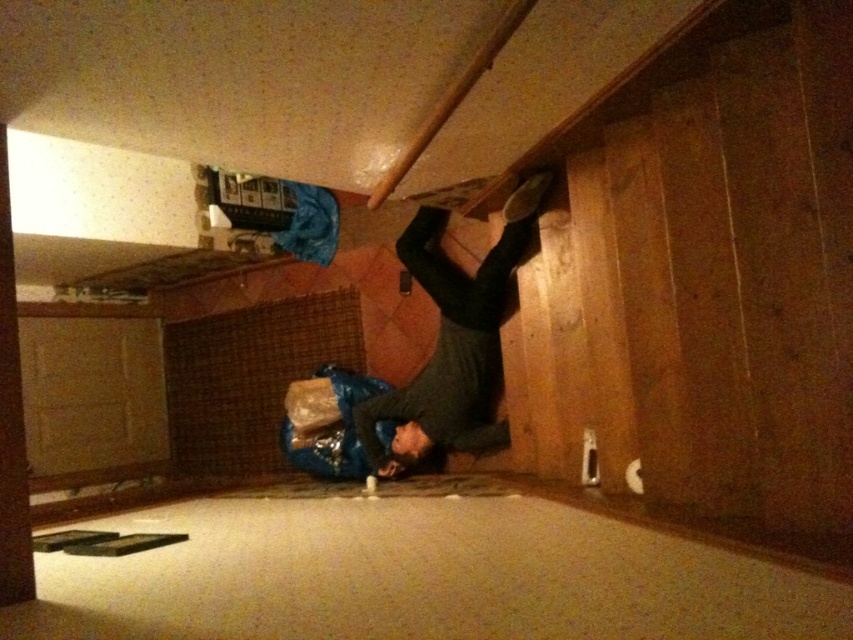
Is carpet at lower center wider than dark gray sweater at center?

Yes.

Is point (631, 636) farther from camera compared to point (440, 252)?

No.

Image resolution: width=853 pixels, height=640 pixels. Identify the location of carpet at lower center. (418, 577).

This screenshot has height=640, width=853. I want to click on carpet at lower center, so click(418, 577).

Consider the image. Who is positioned more to the left, dark gray sweater at center or wooden beam at upper center?

wooden beam at upper center is more to the left.

Is point (515, 240) less distant than point (399, 168)?

That is False.

Where is `dark gray sweater at center`? dark gray sweater at center is located at coordinates (451, 342).

Who is lower down, carpet at lower center or wooden beam at upper center?

carpet at lower center is lower down.

Where is `carpet at lower center`? This screenshot has width=853, height=640. carpet at lower center is located at coordinates (418, 577).